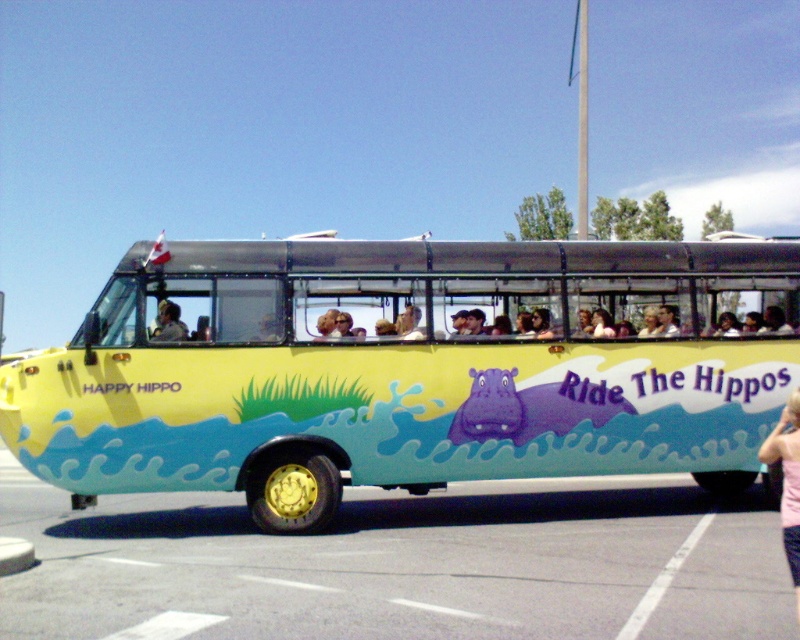
Question: Is yellow matte bus at center to the left of pink fabric at lower right from the viewer's perspective?

Choices:
 (A) yes
 (B) no

Answer: (A)

Question: Can you confirm if yellow matte bus at center is thinner than pink fabric at lower right?

Choices:
 (A) yes
 (B) no

Answer: (B)

Question: Does smooth asphalt parking lot at lower center appear over pink fabric at lower right?

Choices:
 (A) no
 (B) yes

Answer: (A)

Question: Which object is positioned closest to the smooth asphalt parking lot at lower center?

Choices:
 (A) pink fabric at lower right
 (B) light brown leather jacket at center

Answer: (B)

Question: Among these points, which one is farthest from the camera?

Choices:
 (A) (172, 323)
 (B) (780, 442)

Answer: (A)

Question: Which point is closer to the camera taking this photo?

Choices:
 (A) (189, 317)
 (B) (158, 324)
 (C) (140, 556)
 (D) (798, 518)

Answer: (D)